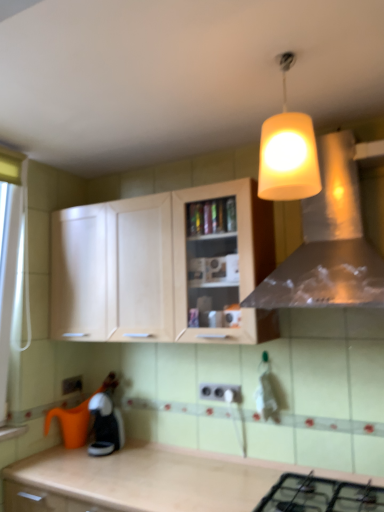
What is the approximate width of white plastic electric outlet at center, which appears as the second electric outlet when viewed from the back?

The width of white plastic electric outlet at center, which appears as the second electric outlet when viewed from the back, is 1.14 inches.

Image resolution: width=384 pixels, height=512 pixels. What do you see at coordinates (288, 151) in the screenshot? I see `yellow matte lampshade at upper center` at bounding box center [288, 151].

What is the approximate height of yellow matte lampshade at upper center?

The height of yellow matte lampshade at upper center is 44.97 centimeters.

What do you see at coordinates (320, 495) in the screenshot?
I see `black matte gas stove at lower center` at bounding box center [320, 495].

Locate an element on the screen. metallic silver vent at upper center is located at coordinates (x=328, y=243).

Is light wood cabinet at center beside yellow matte lampshade at upper center?

light wood cabinet at center and yellow matte lampshade at upper center are clearly separated.

Considering the sizes of objects light wood cabinet at center and yellow matte lampshade at upper center in the image provided, who is smaller, light wood cabinet at center or yellow matte lampshade at upper center?

Smaller between the two is yellow matte lampshade at upper center.

Would you say light wood cabinet at center is inside or outside yellow matte lampshade at upper center?

→ light wood cabinet at center is not inside yellow matte lampshade at upper center, it's outside.

Consider the image. Which of these two, yellow matte lampshade at upper center or white plastic electric outlet at lower center, acting as the first electric outlet starting from the left, is thinner?

With smaller width is white plastic electric outlet at lower center, acting as the first electric outlet starting from the left.

Based on the photo, would you say yellow matte lampshade at upper center is to the left or to the right of white plastic electric outlet at lower center, which is counted as the first electric outlet, starting from the back, in the picture?

Clearly, yellow matte lampshade at upper center is on the right of white plastic electric outlet at lower center, which is counted as the first electric outlet, starting from the back, in the image.

Is yellow matte lampshade at upper center bigger than white plastic electric outlet at lower center, acting as the first electric outlet starting from the left?

Yes.

Does white plastic electric outlet at center, which is counted as the first electric outlet, starting from the right, have a lesser height compared to yellow matte lampshade at upper center?

Indeed, white plastic electric outlet at center, which is counted as the first electric outlet, starting from the right, has a lesser height compared to yellow matte lampshade at upper center.

From the image's perspective, which is below, white plastic electric outlet at center, which is counted as the first electric outlet, starting from the right, or yellow matte lampshade at upper center?

white plastic electric outlet at center, which is counted as the first electric outlet, starting from the right, appears lower in the image.

How far apart are white plastic electric outlet at center, which is the first electric outlet in front-to-back order, and yellow matte lampshade at upper center?

The distance of white plastic electric outlet at center, which is the first electric outlet in front-to-back order, from yellow matte lampshade at upper center is 1.25 meters.

Based on the photo, looking at the image, does white plastic electric outlet at center, which is the first electric outlet in front-to-back order, seem bigger or smaller compared to yellow matte lampshade at upper center?

In the image, white plastic electric outlet at center, which is the first electric outlet in front-to-back order, appears to be smaller than yellow matte lampshade at upper center.

Is the depth of light wood cabinet at center less than that of black matte gas stove at lower center?

No, the depth of light wood cabinet at center is greater than that of black matte gas stove at lower center.

Would you say light wood cabinet at center is to the left or to the right of black matte gas stove at lower center in the picture?

light wood cabinet at center is positioned on black matte gas stove at lower center's left side.

Which is more distant, [100,312] or [292,497]?

The point [100,312] is more distant.

Choose the correct answer: Is light wood cabinet at center inside black matte gas stove at lower center or outside it?

The correct answer is: outside.

Between metallic silver vent at upper center and yellow matte lampshade at upper center, which one appears on the left side from the viewer's perspective?

From the viewer's perspective, yellow matte lampshade at upper center appears more on the left side.

From a real-world perspective, is metallic silver vent at upper center above or below yellow matte lampshade at upper center?

Clearly, from a real-world perspective, metallic silver vent at upper center is below yellow matte lampshade at upper center.

Consider the image. Is metallic silver vent at upper center not within yellow matte lampshade at upper center?

Absolutely, metallic silver vent at upper center is external to yellow matte lampshade at upper center.

Is metallic silver vent at upper center positioned far away from yellow matte lampshade at upper center?

→ They are positioned close to each other.

How many degrees apart are the facing directions of light wood cabinet at center and metallic silver vent at upper center?

1.07 degrees.

Can you confirm if light wood cabinet at center is wider than metallic silver vent at upper center?

No.

Considering the relative positions of light wood cabinet at center and metallic silver vent at upper center in the image provided, is light wood cabinet at center to the right of metallic silver vent at upper center from the viewer's perspective?

No.

Is light wood cabinet at center shorter than metallic silver vent at upper center?

Indeed, light wood cabinet at center has a lesser height compared to metallic silver vent at upper center.

Which is nearer, (278, 172) or (220, 297)?

The point (278, 172) is closer.

Is yellow matte lampshade at upper center oriented away from light wood cabinet at center?

yellow matte lampshade at upper center is not turned away from light wood cabinet at center.

From a real-world perspective, which is physically below, yellow matte lampshade at upper center or light wood cabinet at center?

light wood cabinet at center, from a real-world perspective.

Does yellow matte lampshade at upper center contain light wood cabinet at center?

No, light wood cabinet at center is not a part of yellow matte lampshade at upper center.

Identify the location of lamp that is on the right side of light wood cabinet at center. The width and height of the screenshot is (384, 512). (288, 151).

Image resolution: width=384 pixels, height=512 pixels. Identify the location of lamp above the white plastic electric outlet at lower center, which appears as the 2th electric outlet when viewed from the right (from a real-world perspective). (288, 151).

Based on the photo, based on their spatial positions, is metallic silver vent at upper center or yellow matte lampshade at upper center closer to white plastic electric outlet at center, which is the first electric outlet in front-to-back order?

metallic silver vent at upper center is positioned closer to the anchor white plastic electric outlet at center, which is the first electric outlet in front-to-back order.

Which object lies further to the anchor point yellow matte lampshade at upper center, white plastic electric outlet at center, which appears as the second electric outlet when viewed from the back, or metallic silver vent at upper center?

Based on the image, white plastic electric outlet at center, which appears as the second electric outlet when viewed from the back, appears to be further to yellow matte lampshade at upper center.

Looking at the image, which one is located closer to white plastic electric outlet at center, which is counted as the first electric outlet, starting from the right, light wood cabinet at center or black matte gas stove at lower center?

black matte gas stove at lower center.

Considering their positions, is metallic silver vent at upper center positioned closer to white plastic electric outlet at lower center, which is counted as the first electric outlet, starting from the back, than yellow matte lampshade at upper center?

metallic silver vent at upper center.

Estimate the real-world distances between objects in this image. Which object is further from metallic silver vent at upper center, yellow matte lampshade at upper center or white plastic electric outlet at lower center, marked as the second electric outlet in a front-to-back arrangement?

The object further to metallic silver vent at upper center is white plastic electric outlet at lower center, marked as the second electric outlet in a front-to-back arrangement.

Which object lies nearer to the anchor point black matte gas stove at lower center, metallic silver vent at upper center or yellow matte lampshade at upper center?

The object closer to black matte gas stove at lower center is metallic silver vent at upper center.

Considering their positions, is white plastic electric outlet at lower center, marked as the second electric outlet in a front-to-back arrangement, positioned further to white plastic electric outlet at center, which is counted as the first electric outlet, starting from the right, than black matte gas stove at lower center?

white plastic electric outlet at lower center, marked as the second electric outlet in a front-to-back arrangement, is positioned further to the anchor white plastic electric outlet at center, which is counted as the first electric outlet, starting from the right.

Considering their positions, is light wood cabinet at center positioned further to black matte gas stove at lower center than white plastic electric outlet at lower center, which is counted as the first electric outlet, starting from the back?

The object further to black matte gas stove at lower center is white plastic electric outlet at lower center, which is counted as the first electric outlet, starting from the back.

Where is `gas stove between white plastic electric outlet at lower center, marked as the second electric outlet in a front-to-back arrangement, and metallic silver vent at upper center, in the horizontal direction`? The image size is (384, 512). gas stove between white plastic electric outlet at lower center, marked as the second electric outlet in a front-to-back arrangement, and metallic silver vent at upper center, in the horizontal direction is located at coordinates (320, 495).

Image resolution: width=384 pixels, height=512 pixels. Identify the location of electric outlet between yellow matte lampshade at upper center and white plastic electric outlet at lower center, marked as the second electric outlet in a front-to-back arrangement, in the vertical direction. (221, 392).

The image size is (384, 512). I want to click on cabinetry between white plastic electric outlet at lower center, acting as the first electric outlet starting from the left, and white plastic electric outlet at center, which is counted as the first electric outlet, starting from the right, in the horizontal direction, so pyautogui.click(x=162, y=266).

The height and width of the screenshot is (512, 384). In order to click on cabinetry between white plastic electric outlet at lower center, acting as the first electric outlet starting from the left, and metallic silver vent at upper center in this screenshot , I will do `click(162, 266)`.